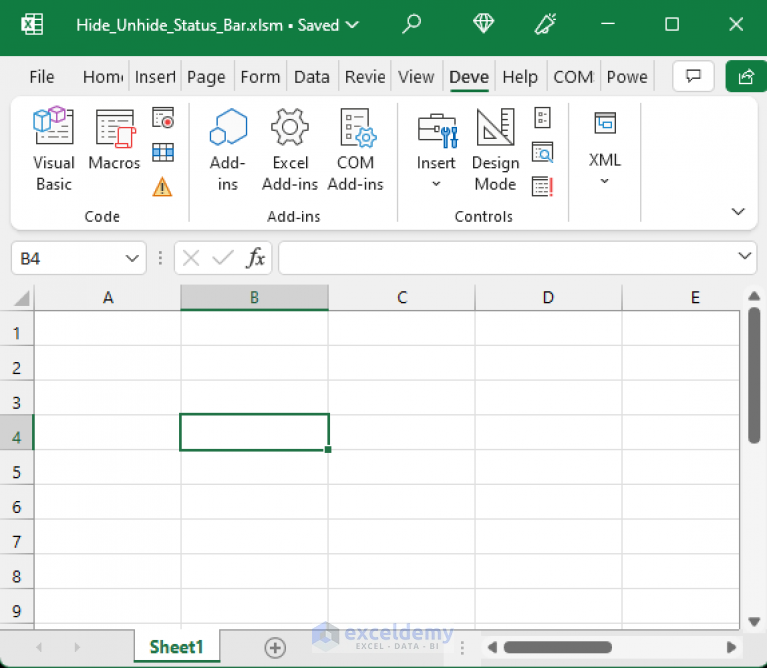
This screenshot has width=767, height=668. Identify the location of columns. (104, 290), (255, 302), (403, 297), (548, 292), (700, 298).